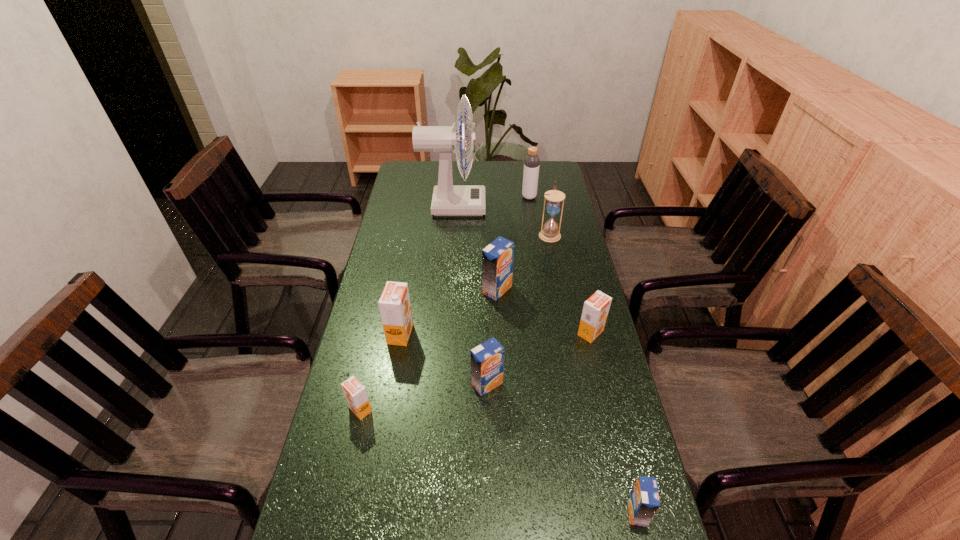
You are a GUI agent. You are given a task and a screenshot of the screen. Output one action in this format:
    pyautogui.click(x=<x>, y=<y>)
    Task: Click on the second smallest orange orange juice
    
    Given the screenshot: What is the action you would take?
    pyautogui.click(x=595, y=310)

At what (x,y) coordinates should I click in order to perform the action: click on the rightmost blue orange_juice. Please return your answer as a coordinate pair (x, y). Looking at the image, I should click on (643, 501).

Locate an element on the screen. Image resolution: width=960 pixels, height=540 pixels. the nearest blue orange_juice is located at coordinates (643, 501).

At what (x,y) coordinates should I click in order to perform the action: click on the eighth farthest object. Please return your answer as a coordinate pair (x, y). The width and height of the screenshot is (960, 540). Looking at the image, I should click on (355, 393).

This screenshot has width=960, height=540. Find the location of `the leftmost orange juice`. the leftmost orange juice is located at coordinates (355, 393).

Locate an element on the screen. The width and height of the screenshot is (960, 540). blank area located on the front-facing side of the fan is located at coordinates 507,206.

At what (x,y) coordinates should I click in order to perform the action: click on vacant space located 0.240m on the front of the bottle. Please return your answer as a coordinate pair (x, y). This screenshot has height=540, width=960. Looking at the image, I should click on click(x=535, y=235).

The height and width of the screenshot is (540, 960). In order to click on vacant point located 0.320m on the front of the hourglass in this screenshot , I will do `click(564, 304)`.

Identify the location of free space located 0.180m on the right of the farthest blue orange_juice. This screenshot has width=960, height=540. (567, 290).

Find the location of a particular element. vacant space situated on the right of the second orange orange juice from right to left is located at coordinates (514, 334).